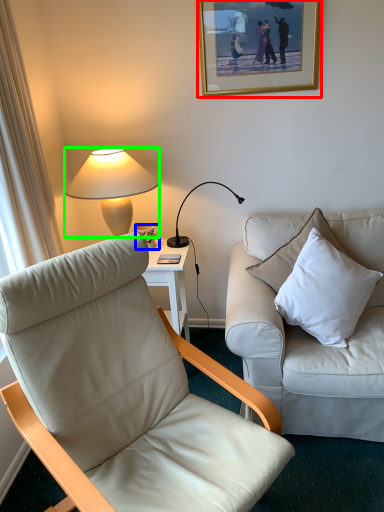
Question: Which is nearer to the picture frame (highlighted by a red box)? coffee cup (highlighted by a blue box) or lamp (highlighted by a green box).

Choices:
 (A) coffee cup
 (B) lamp

Answer: (B)